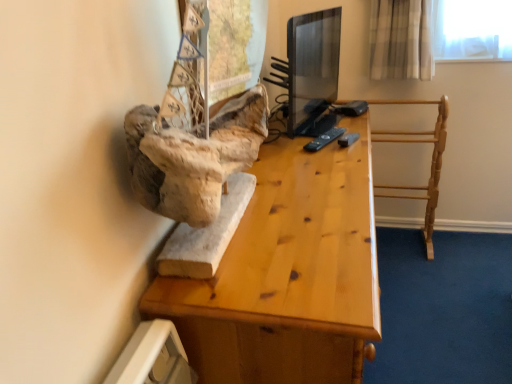
Question: From a real-world perspective, relative to light wood towel rack at right, is wooden desk at center vertically above or below?

Choices:
 (A) above
 (B) below

Answer: (B)

Question: In the image, is wooden desk at center positioned in front of or behind light wood towel rack at right?

Choices:
 (A) behind
 (B) front

Answer: (B)

Question: Which object is positioned farthest from the wooden desk at center?

Choices:
 (A) black plastic remote at center
 (B) light wood towel rack at right

Answer: (B)

Question: Estimate the real-world distances between objects in this image. Which object is closer to the light wood towel rack at right?

Choices:
 (A) black plastic remote at center
 (B) wooden desk at center

Answer: (A)